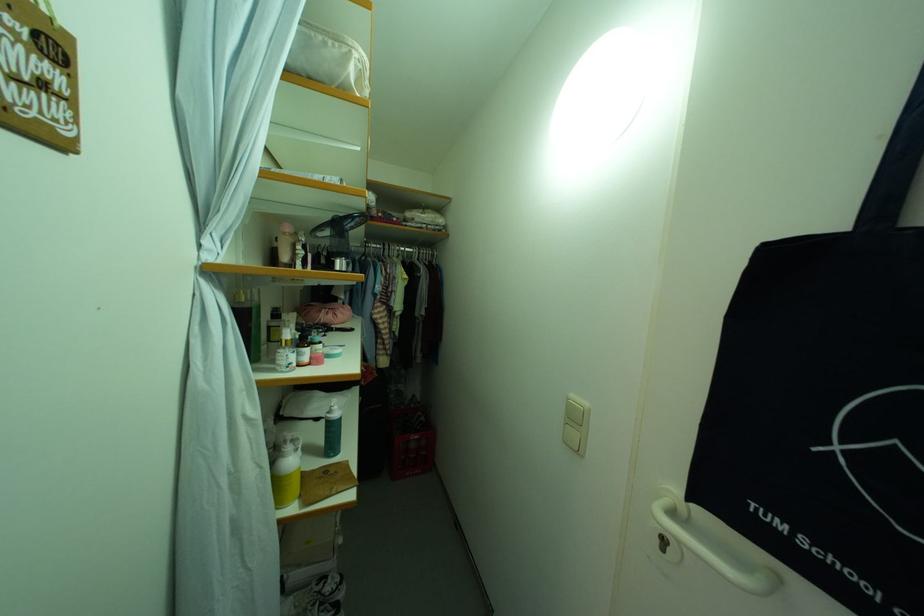
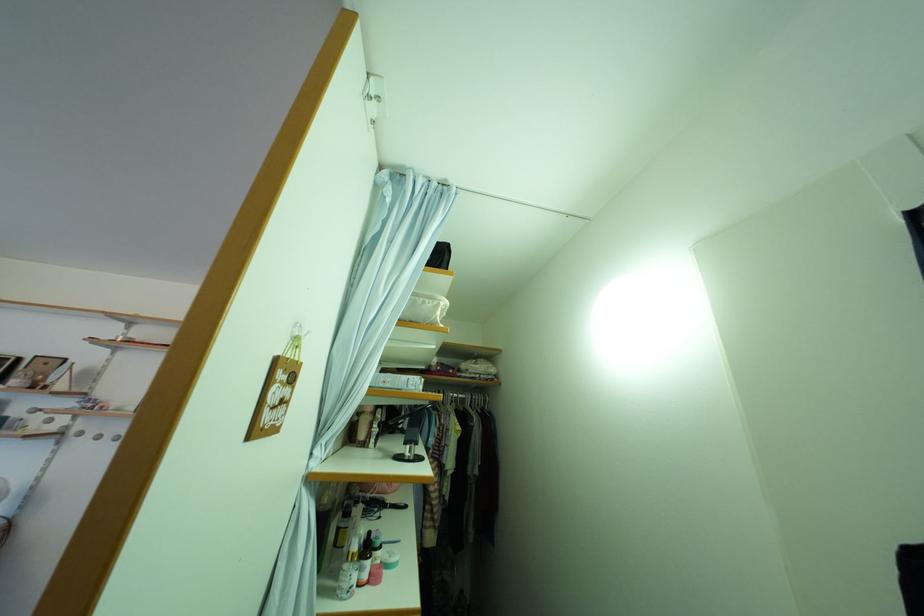
Question: The first image is from the beginning of the video and the second image is from the end. How did the camera likely rotate when shooting the video?

Choices:
 (A) Left
 (B) Right
 (C) Up
 (D) Down

Answer: (C)